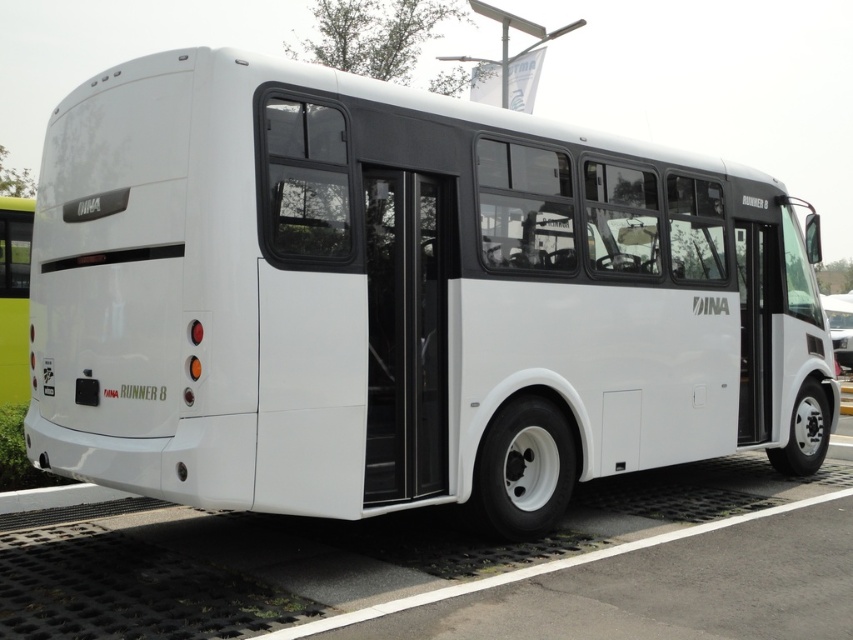
You are a delivery person trying to load a tall package into the white matte bus at center. The package is exactly as tall as the transparent glass door at center. Can the package fit inside the bus vertically?

The white matte bus at center is not as tall as the transparent glass door at center, so the package which is as tall as the transparent glass door at center would be taller than the bus. Therefore, the package cannot fit inside the bus vertically.

You are standing in front of the INA RUNNER 8 bus and notice the white matte door at center. Where exactly is this door positioned on the bus?

The white matte door at center is located at point coordinates of 0.519 on the x axis and 0.884 on the y axis.